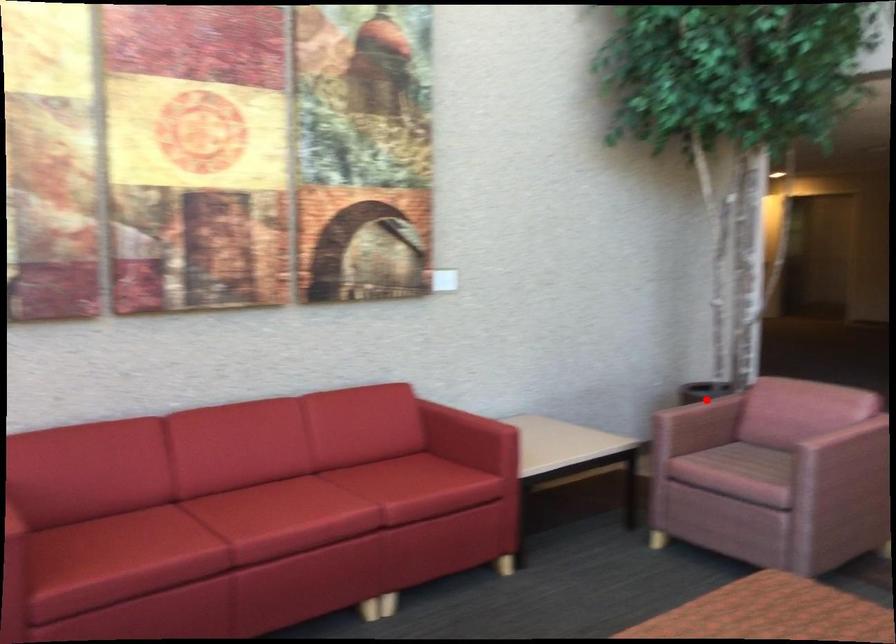
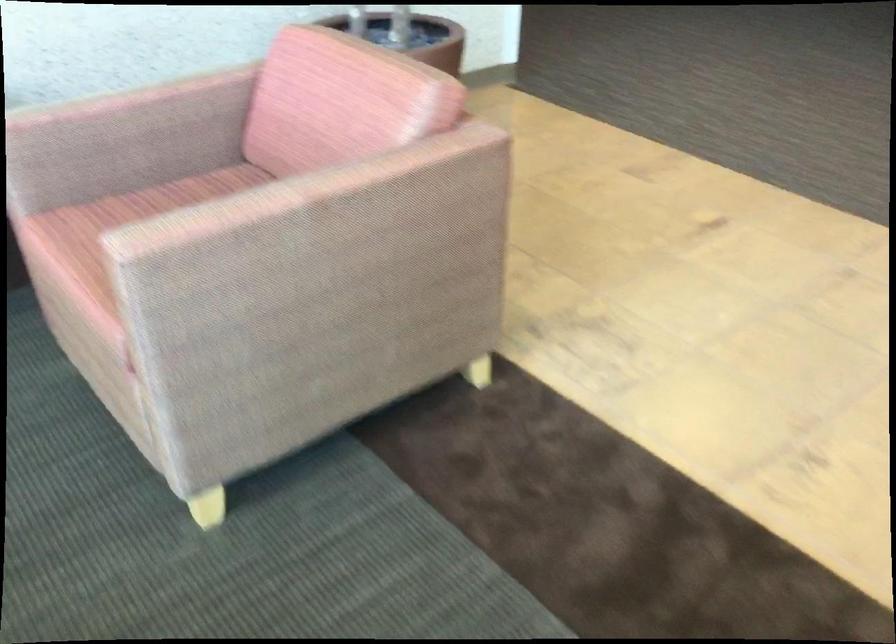
Question: I am providing you with two images of the same scene from different viewpoints. A red point is marked on the first image. Can you still see the location of the red point in image 2?

Choices:
 (A) Yes
 (B) No

Answer: (A)